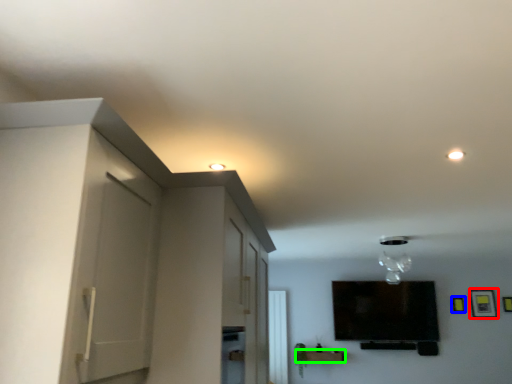
Question: Estimate the real-world distances between objects in this image. Which object is farther from picture frame (highlighted by a red box), picture frame (highlighted by a blue box) or furniture (highlighted by a green box)?

Choices:
 (A) picture frame
 (B) furniture

Answer: (B)